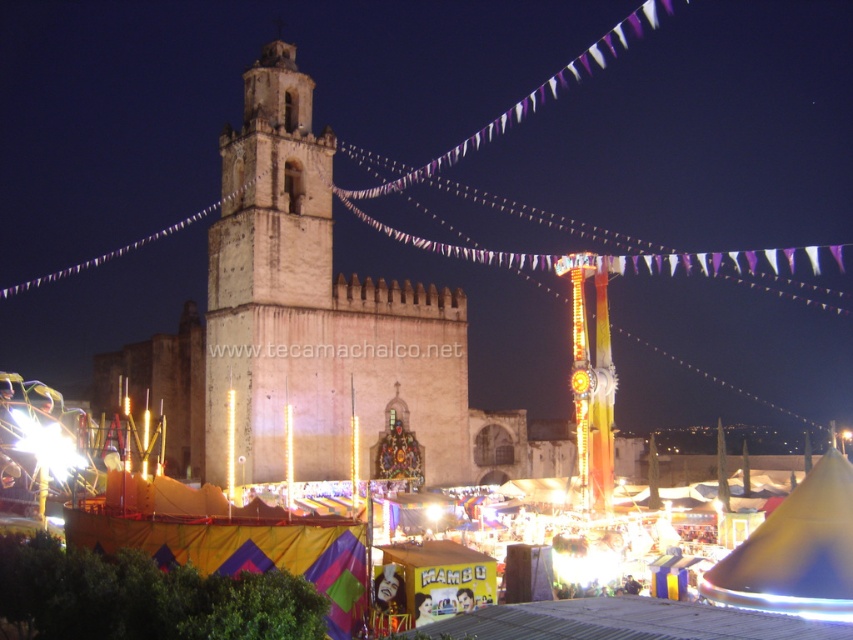
Question: Among these points, which one is nearest to the camera?

Choices:
 (A) (239, 294)
 (B) (265, 540)

Answer: (B)

Question: Is light brown stone tower at center above multicolored fabric tent at center?

Choices:
 (A) no
 (B) yes

Answer: (B)

Question: Does light brown stone tower at center lie in front of multicolored fabric tent at center?

Choices:
 (A) yes
 (B) no

Answer: (B)

Question: Where is light brown stone tower at center located in relation to multicolored fabric tent at center in the image?

Choices:
 (A) above
 (B) below

Answer: (A)

Question: Which of the following is the closest to the observer?

Choices:
 (A) (287, 298)
 (B) (151, 493)

Answer: (B)

Question: Which object is farther from the camera taking this photo?

Choices:
 (A) multicolored fabric tent at center
 (B) light brown stone tower at center

Answer: (B)